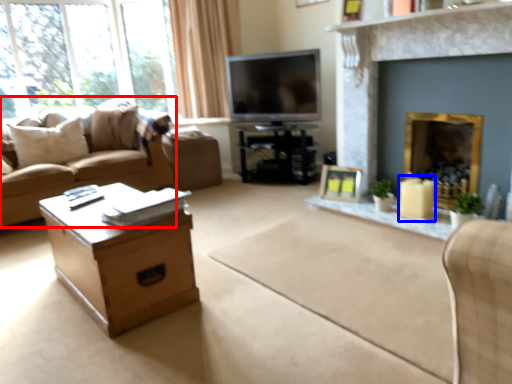
Question: Which of the following is the farthest to the observer, studio couch (highlighted by a red box) or candle holder (highlighted by a blue box)?

Choices:
 (A) studio couch
 (B) candle holder

Answer: (A)